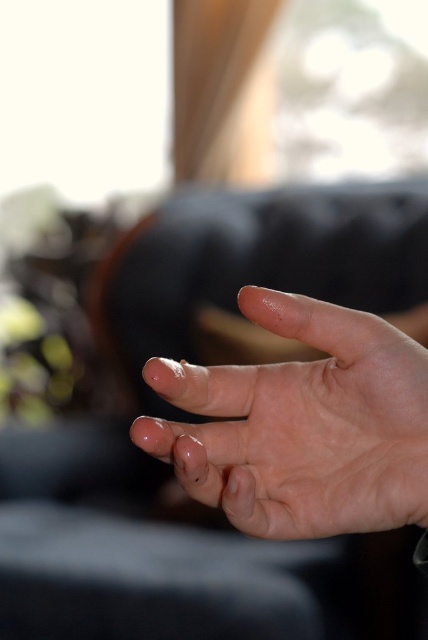
Question: Which point is farther to the camera?

Choices:
 (A) (374, 387)
 (B) (184, 468)

Answer: (A)

Question: Which point is closer to the camera taking this photo?

Choices:
 (A) (250, 400)
 (B) (148, 376)
 (C) (174, 449)

Answer: (C)

Question: Can you confirm if transparent gel toe at center is wider than clear skin toe at center?

Choices:
 (A) no
 (B) yes

Answer: (B)

Question: Is transparent gel toe at center positioned at the back of clear skin toe at center?

Choices:
 (A) yes
 (B) no

Answer: (B)

Question: Which point is closer to the camera taking this photo?

Choices:
 (A) (152, 381)
 (B) (181, 432)

Answer: (A)

Question: Is smooth skin hand at center bigger than clear skin toe at center?

Choices:
 (A) no
 (B) yes

Answer: (B)